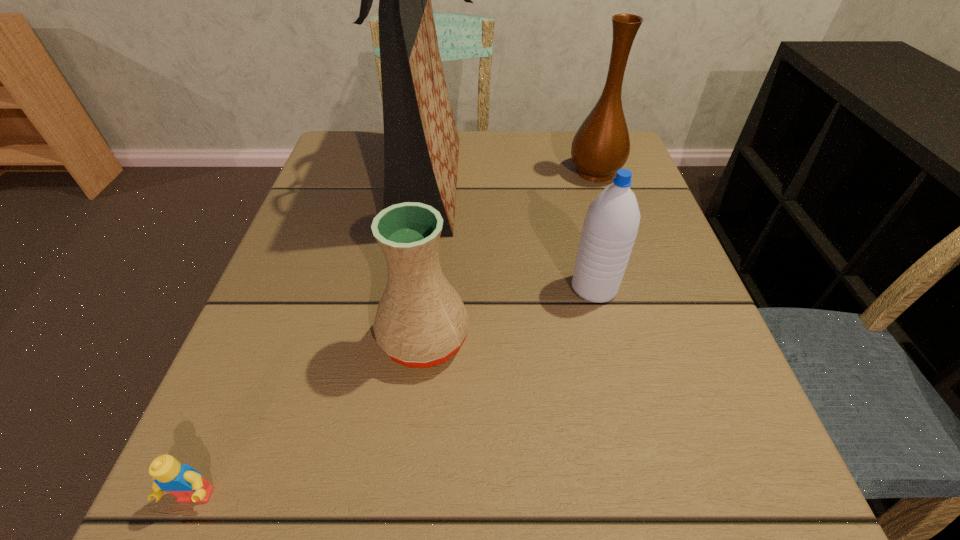
Find the location of `shopping bag that is at the far edge`. shopping bag that is at the far edge is located at coordinates (421, 144).

You are a GUI agent. You are given a task and a screenshot of the screen. Output one action in this format:
    pyautogui.click(x=<x>, y=<y>)
    Task: Click on the vase situated at the far edge
    The width and height of the screenshot is (960, 540).
    Given the screenshot: What is the action you would take?
    pyautogui.click(x=601, y=146)

You are a GUI agent. You are given a task and a screenshot of the screen. Output one action in this format:
    pyautogui.click(x=<x>, y=<y>)
    Task: Click on the object that is at the near edge
    This screenshot has height=540, width=960.
    Given the screenshot: What is the action you would take?
    pyautogui.click(x=185, y=483)

In order to click on shopping bag at the left edge in this screenshot , I will do `click(421, 144)`.

Locate an element on the screen. The image size is (960, 540). Lego that is at the left edge is located at coordinates (185, 483).

Locate an element on the screen. vase present at the right edge is located at coordinates (601, 146).

The image size is (960, 540). I want to click on water bottle located at the right edge, so click(610, 227).

At what (x,y) coordinates should I click in order to perform the action: click on object situated at the far left corner. Please return your answer as a coordinate pair (x, y). Looking at the image, I should click on click(421, 144).

Where is `object positioned at the near left corner`? The image size is (960, 540). object positioned at the near left corner is located at coordinates (185, 483).

Identify the location of object situated at the far right corner. Image resolution: width=960 pixels, height=540 pixels. (601, 146).